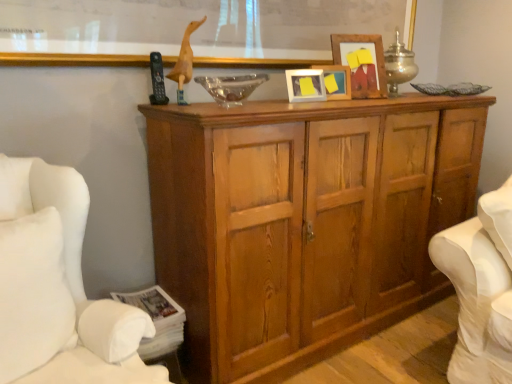
Question: Is transparent glass bowl at center placed right next to wooden picture frame at upper center, which is the third picture frame in left-to-right order?

Choices:
 (A) no
 (B) yes

Answer: (A)

Question: Considering the relative positions of transparent glass bowl at center and wooden picture frame at upper center, placed as the 1th picture frame when sorted from right to left, in the image provided, is transparent glass bowl at center in front of wooden picture frame at upper center, placed as the 1th picture frame when sorted from right to left,?

Choices:
 (A) yes
 (B) no

Answer: (A)

Question: Does transparent glass bowl at center come behind wooden picture frame at upper center, placed as the 1th picture frame when sorted from right to left?

Choices:
 (A) no
 (B) yes

Answer: (A)

Question: Is transparent glass bowl at center oriented towards wooden picture frame at upper center, placed as the 1th picture frame when sorted from right to left?

Choices:
 (A) yes
 (B) no

Answer: (B)

Question: From the image's perspective, does transparent glass bowl at center appear higher than wooden picture frame at upper center, placed as the 1th picture frame when sorted from right to left?

Choices:
 (A) yes
 (B) no

Answer: (B)

Question: Is transparent glass bowl at center completely or partially outside of wooden picture frame at upper center, placed as the 1th picture frame when sorted from right to left?

Choices:
 (A) yes
 (B) no

Answer: (A)

Question: Is wooden picture frame at center, the second picture frame viewed from the right, facing towards metallic silver table lamp at upper center?

Choices:
 (A) no
 (B) yes

Answer: (A)

Question: Is wooden picture frame at center, the second picture frame viewed from the right, facing away from metallic silver table lamp at upper center?

Choices:
 (A) no
 (B) yes

Answer: (A)

Question: Can you confirm if wooden picture frame at center, the second picture frame viewed from the right, is smaller than metallic silver table lamp at upper center?

Choices:
 (A) yes
 (B) no

Answer: (A)

Question: Is wooden picture frame at center, which is the second picture frame from left to right, not inside metallic silver table lamp at upper center?

Choices:
 (A) yes
 (B) no

Answer: (A)

Question: From the image's perspective, would you say wooden picture frame at center, which is the second picture frame from left to right, is positioned over metallic silver table lamp at upper center?

Choices:
 (A) no
 (B) yes

Answer: (A)

Question: Considering the relative positions of wooden picture frame at center, which is the second picture frame from left to right, and metallic silver table lamp at upper center in the image provided, is wooden picture frame at center, which is the second picture frame from left to right, behind metallic silver table lamp at upper center?

Choices:
 (A) yes
 (B) no

Answer: (B)

Question: Could you tell me if metallic silver table lamp at upper center is turned towards wooden frame at upper center?

Choices:
 (A) no
 (B) yes

Answer: (A)